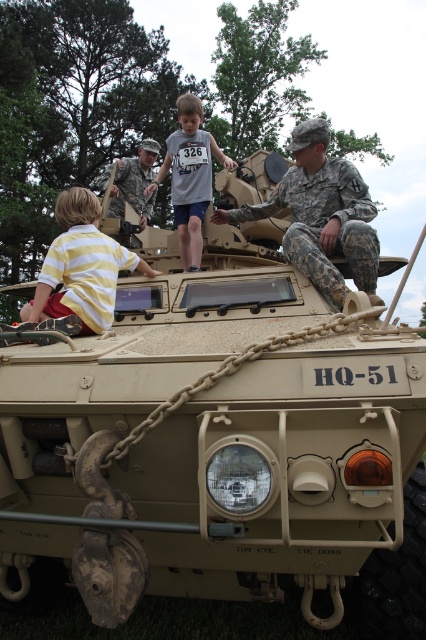
You are a photographer trying to capture the APC with the yellow striped shirt at left in the frame. Where should you position yourself relative to the APC to include both in the shot?

To include both the APC and the yellow striped shirt at left in the frame, position yourself to the left side of the APC, near the location of the yellow striped shirt at left, which is at coordinates approximately 0.417 on the x and 0.192 on the y axis.